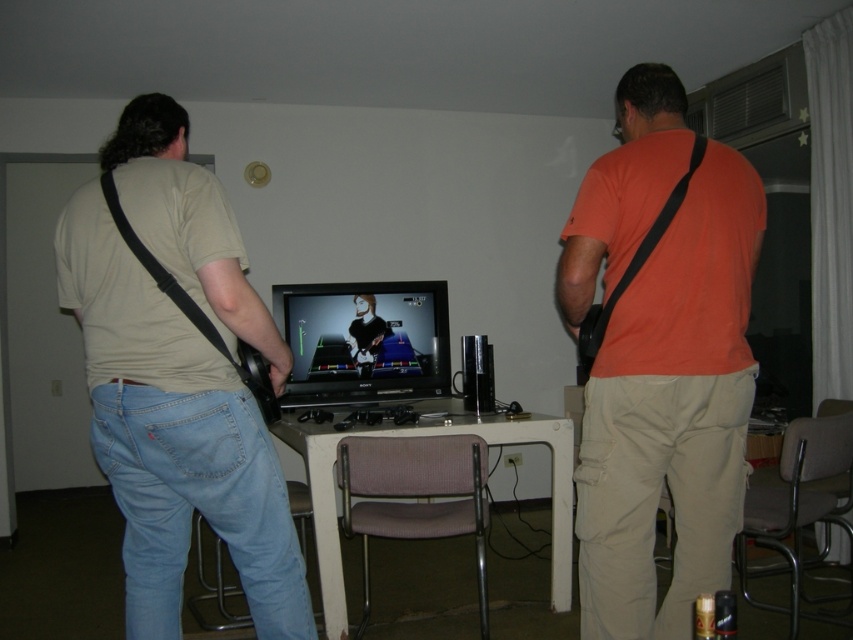
You are standing in the room and want to locate the matte beige shirt at left. According to the coordinates provided, where would you look to find it?

The matte beige shirt at left is located at the 2D coordinates point (173, 436).

Looking at this image, you are standing in the room and want to place a new poster on the wall between the two points, point (561, 259) and point (271, 426). Which point is closer to the front of the room?

Point (561, 259) is in front of point (271, 426), so it is closer to the front of the room.